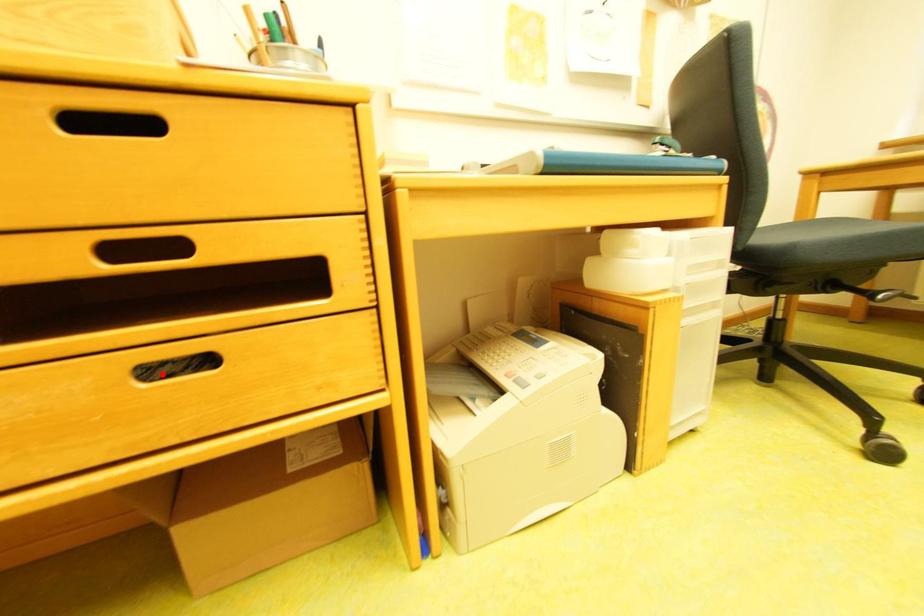
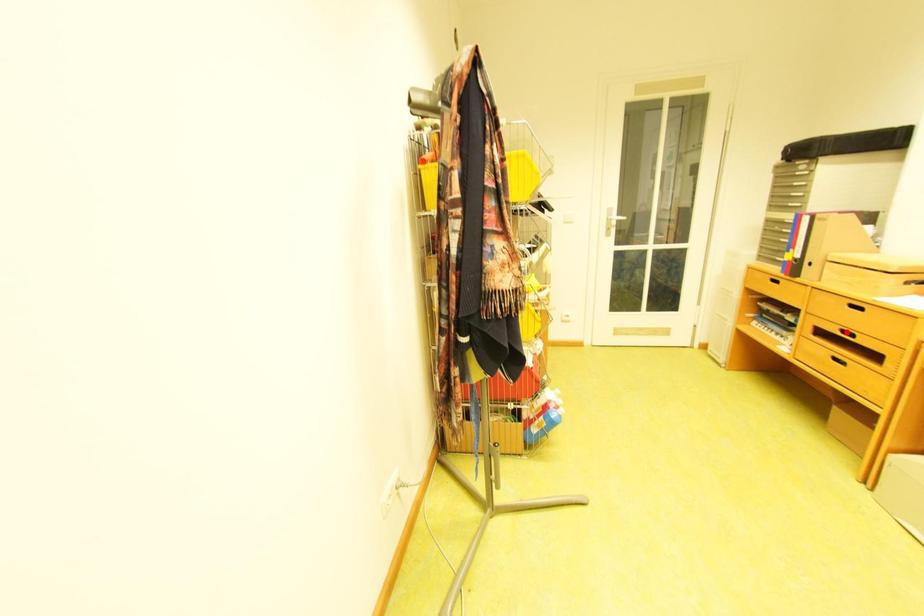
I am providing you with two images of the same scene from different viewpoints. A red point is marked on the first image and another point is marked on the second image. Is the red point in image1 aligned with the point shown in image2?

No